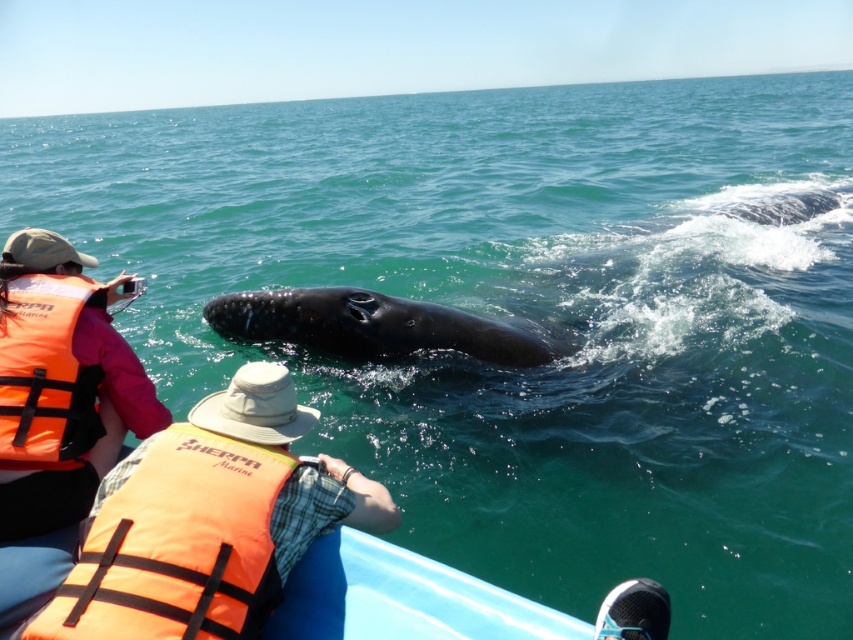
You are on a boat and want to take a photo of the black smooth humpback whale at center without the orange fabric life jacket at lower left blocking the view. Is the whale visible from your current position?

The orange fabric life jacket at lower left is closer to the viewer than the black smooth humpback whale at center, so the whale is partially visible behind the life jacket.